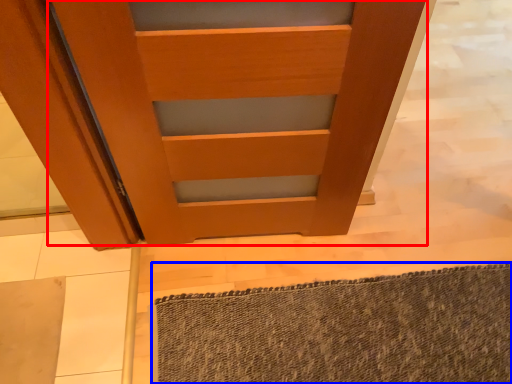
Question: Which of the following is the farthest to the observer, door (highlighted by a red box) or bath mat (highlighted by a blue box)?

Choices:
 (A) door
 (B) bath mat

Answer: (B)